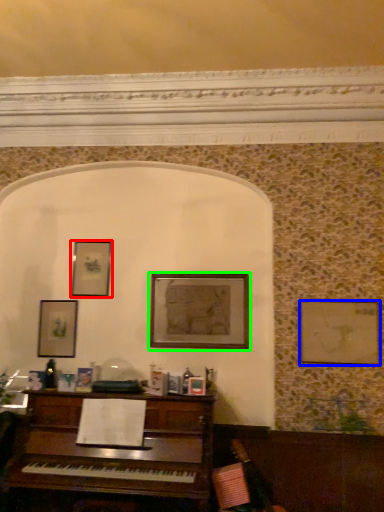
Question: Considering the real-world distances, which object is farthest from picture frame (highlighted by a red box)? picture frame (highlighted by a blue box) or picture frame (highlighted by a green box)?

Choices:
 (A) picture frame
 (B) picture frame

Answer: (A)